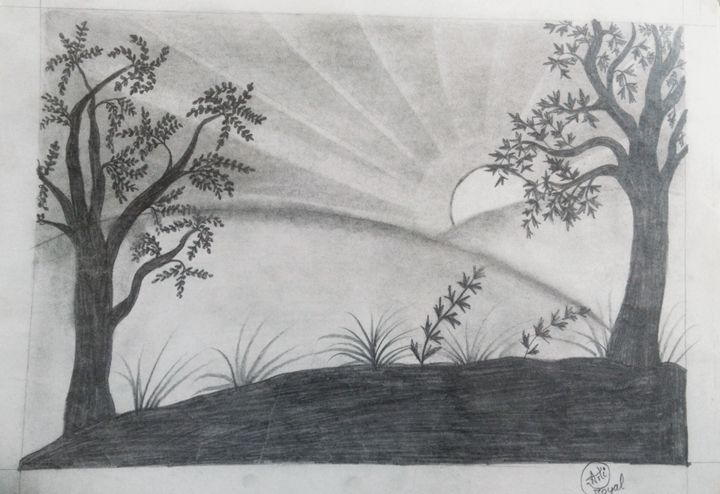
Find the location of `corners`. corners is located at coordinates (685, 461), (682, 24), (39, 7), (18, 470).